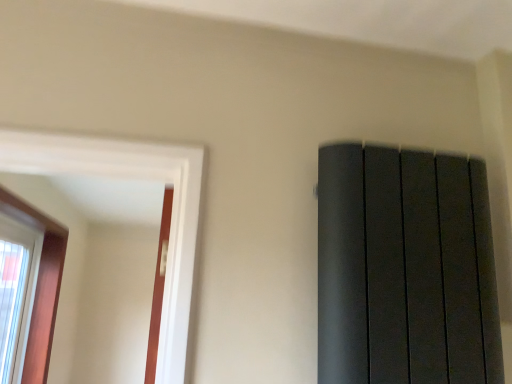
Question: Can you confirm if clear glass window at left, the 2th window positioned from the right, is smaller than wooden frame window at left, positioned as the 1th window in right-to-left order?

Choices:
 (A) yes
 (B) no

Answer: (A)

Question: Does clear glass window at left, the first window when ordered from left to right, have a greater height compared to wooden frame window at left, which ranks as the second window in left-to-right order?

Choices:
 (A) yes
 (B) no

Answer: (B)

Question: Can you confirm if clear glass window at left, the 2th window positioned from the right, is wider than wooden frame window at left, positioned as the 1th window in right-to-left order?

Choices:
 (A) yes
 (B) no

Answer: (B)

Question: Is clear glass window at left, the first window when ordered from left to right, further to the viewer compared to wooden frame window at left, positioned as the 1th window in right-to-left order?

Choices:
 (A) no
 (B) yes

Answer: (B)

Question: Could you tell me if clear glass window at left, the 2th window positioned from the right, is facing wooden frame window at left, which ranks as the second window in left-to-right order?

Choices:
 (A) no
 (B) yes

Answer: (B)

Question: From the image's perspective, is clear glass window at left, the first window when ordered from left to right, located beneath wooden frame window at left, positioned as the 1th window in right-to-left order?

Choices:
 (A) no
 (B) yes

Answer: (B)

Question: Does wooden frame window at left, positioned as the 1th window in right-to-left order, come behind clear glass window at left, the 2th window positioned from the right?

Choices:
 (A) no
 (B) yes

Answer: (A)

Question: Can you confirm if wooden frame window at left, which ranks as the second window in left-to-right order, is shorter than clear glass window at left, the first window when ordered from left to right?

Choices:
 (A) no
 (B) yes

Answer: (A)

Question: Considering the relative positions of wooden frame window at left, which ranks as the second window in left-to-right order, and clear glass window at left, the first window when ordered from left to right, in the image provided, is wooden frame window at left, which ranks as the second window in left-to-right order, to the right of clear glass window at left, the first window when ordered from left to right, from the viewer's perspective?

Choices:
 (A) yes
 (B) no

Answer: (A)

Question: Is wooden frame window at left, which ranks as the second window in left-to-right order, turned away from clear glass window at left, the 2th window positioned from the right?

Choices:
 (A) no
 (B) yes

Answer: (B)

Question: From the image's perspective, is wooden frame window at left, positioned as the 1th window in right-to-left order, beneath clear glass window at left, the first window when ordered from left to right?

Choices:
 (A) no
 (B) yes

Answer: (A)

Question: Can you confirm if wooden frame window at left, positioned as the 1th window in right-to-left order, is wider than clear glass window at left, the 2th window positioned from the right?

Choices:
 (A) yes
 (B) no

Answer: (A)

Question: Considering the positions of point (25, 372) and point (12, 372), is point (25, 372) closer or farther from the camera than point (12, 372)?

Choices:
 (A) closer
 (B) farther

Answer: (B)